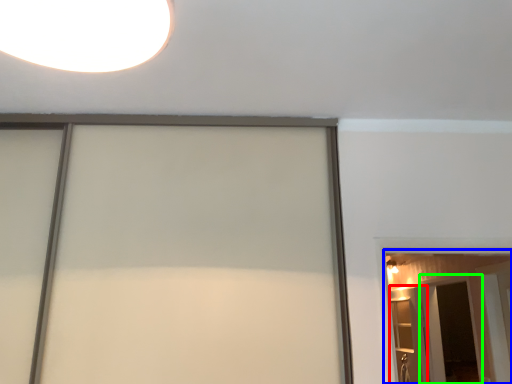
Question: Based on their relative distances, which object is farther from elevator (highlighted by a red box)? Choose from barn door (highlighted by a blue box) and screen door (highlighted by a green box).

Choices:
 (A) barn door
 (B) screen door

Answer: (A)